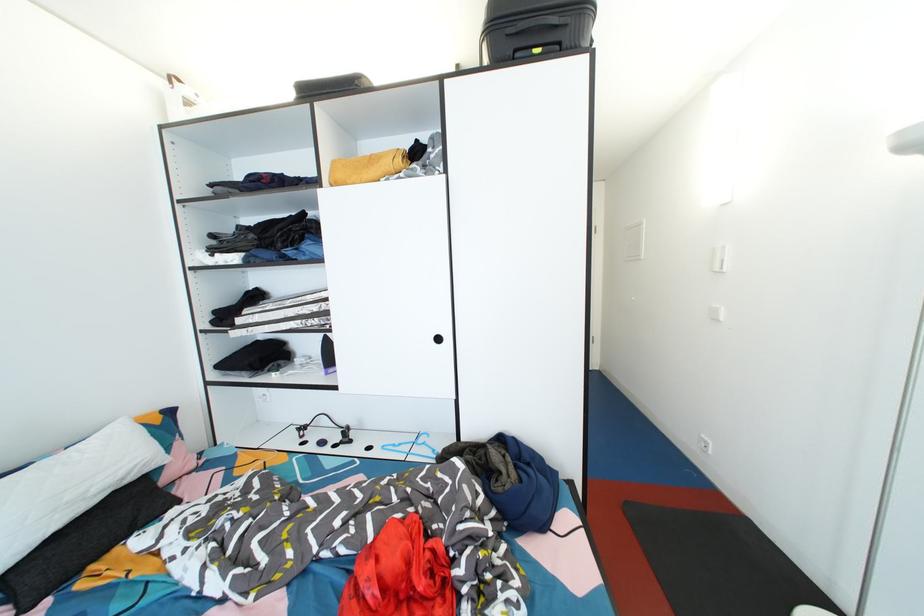
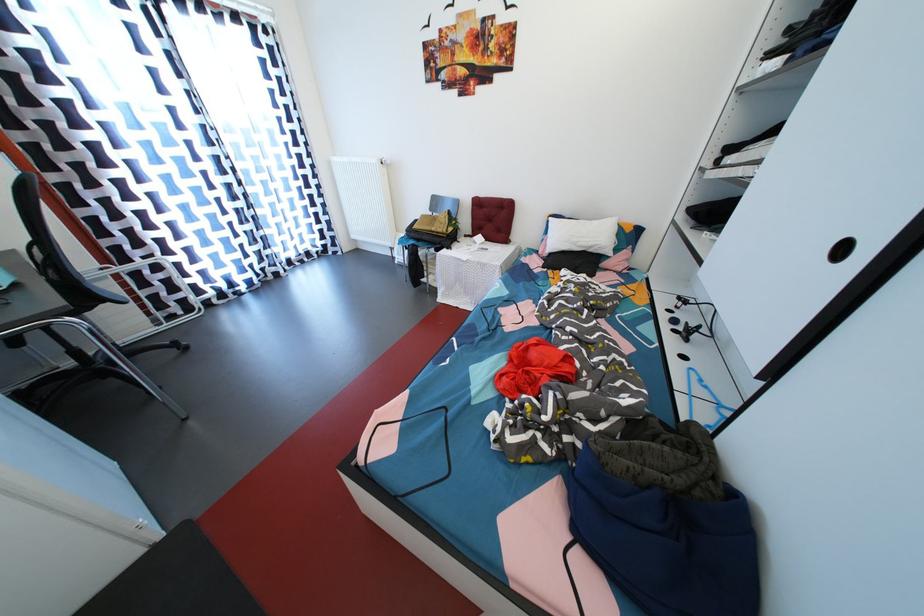
Where in the second image is the point corresponding to point (128, 477) from the first image?

(597, 249)